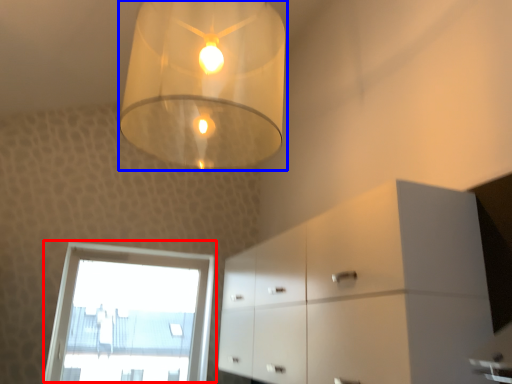
Question: Which object appears farthest to the camera in this image, window (highlighted by a red box) or lamp (highlighted by a blue box)?

Choices:
 (A) window
 (B) lamp

Answer: (A)